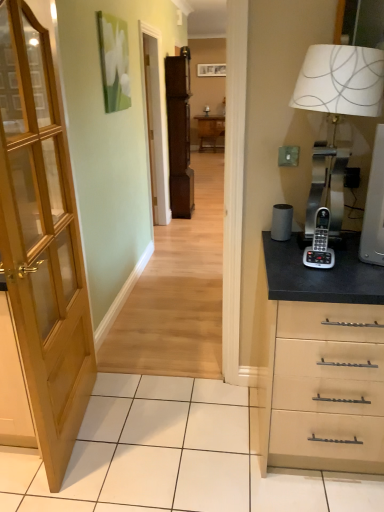
Question: Should I look upward or downward to see wooden picture frame at upper center?

Choices:
 (A) up
 (B) down

Answer: (A)

Question: Is matte wooden screen door at center further to camera compared to brown wood file cabinet at center?

Choices:
 (A) yes
 (B) no

Answer: (B)

Question: Does matte wooden screen door at center have a greater height compared to brown wood file cabinet at center?

Choices:
 (A) no
 (B) yes

Answer: (B)

Question: Is brown wood file cabinet at center inside matte wooden screen door at center?

Choices:
 (A) yes
 (B) no

Answer: (B)

Question: Considering the relative sizes of matte wooden screen door at center and brown wood file cabinet at center in the image provided, is matte wooden screen door at center thinner than brown wood file cabinet at center?

Choices:
 (A) no
 (B) yes

Answer: (B)

Question: Is matte wooden screen door at center in front of brown wood file cabinet at center?

Choices:
 (A) yes
 (B) no

Answer: (A)

Question: From the image's perspective, is matte wooden screen door at center beneath brown wood file cabinet at center?

Choices:
 (A) yes
 (B) no

Answer: (A)

Question: From the image's perspective, is wooden door at left located above matte wooden screen door at center?

Choices:
 (A) no
 (B) yes

Answer: (A)

Question: Is wooden door at left at the left side of matte wooden screen door at center?

Choices:
 (A) yes
 (B) no

Answer: (A)

Question: Considering the relative sizes of wooden door at left and matte wooden screen door at center in the image provided, is wooden door at left taller than matte wooden screen door at center?

Choices:
 (A) no
 (B) yes

Answer: (A)

Question: Does wooden door at left have a lesser width compared to matte wooden screen door at center?

Choices:
 (A) yes
 (B) no

Answer: (A)

Question: Can you confirm if wooden door at left is shorter than matte wooden screen door at center?

Choices:
 (A) yes
 (B) no

Answer: (A)

Question: From a real-world perspective, is wooden door at left on matte wooden screen door at center?

Choices:
 (A) yes
 (B) no

Answer: (B)

Question: From the image's perspective, does wooden table at center appear higher than silver metallic phone at right?

Choices:
 (A) no
 (B) yes

Answer: (B)